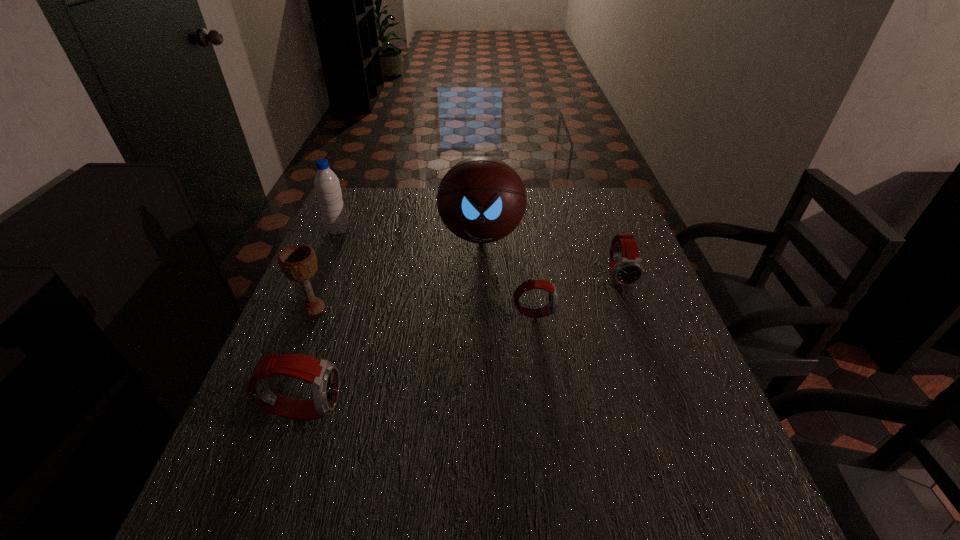
You are a GUI agent. You are given a task and a screenshot of the screen. Output one action in this format:
    pyautogui.click(x=<x>, y=<y>)
    Task: Click on the empty space between the second watch from left to right and the water bottle
    
    Given the screenshot: What is the action you would take?
    pyautogui.click(x=436, y=272)

Identify the location of free space that is in between the shortest watch and the basketball. This screenshot has width=960, height=540. (508, 274).

Locate an element on the screen. This screenshot has height=540, width=960. vacant space that is in between the water bottle and the second shortest object is located at coordinates (479, 254).

What are the coordinates of `vacant area that lies between the shortest watch and the water bottle` in the screenshot? It's located at (436, 272).

Locate an element on the screen. Image resolution: width=960 pixels, height=540 pixels. free space between the chalice and the basketball is located at coordinates (397, 272).

The width and height of the screenshot is (960, 540). I want to click on unoccupied position between the water bottle and the tallest watch, so click(321, 320).

Identify the location of free spot between the tallest watch and the basketball. (393, 322).

The width and height of the screenshot is (960, 540). Identify the location of empty space that is in between the second shortest object and the chalice. (467, 293).

Identify the location of object that is the third closest to the tallest watch. This screenshot has width=960, height=540. (481, 199).

Find the location of a particular element. Image resolution: width=960 pixels, height=540 pixels. object that is the fifth nearest to the basketball is located at coordinates (323, 377).